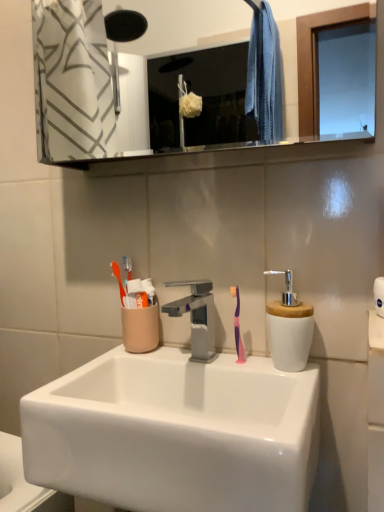
The image size is (384, 512). Find the location of `vacant region to the left of white ceramic soap dispenser at right`. vacant region to the left of white ceramic soap dispenser at right is located at coordinates (218, 367).